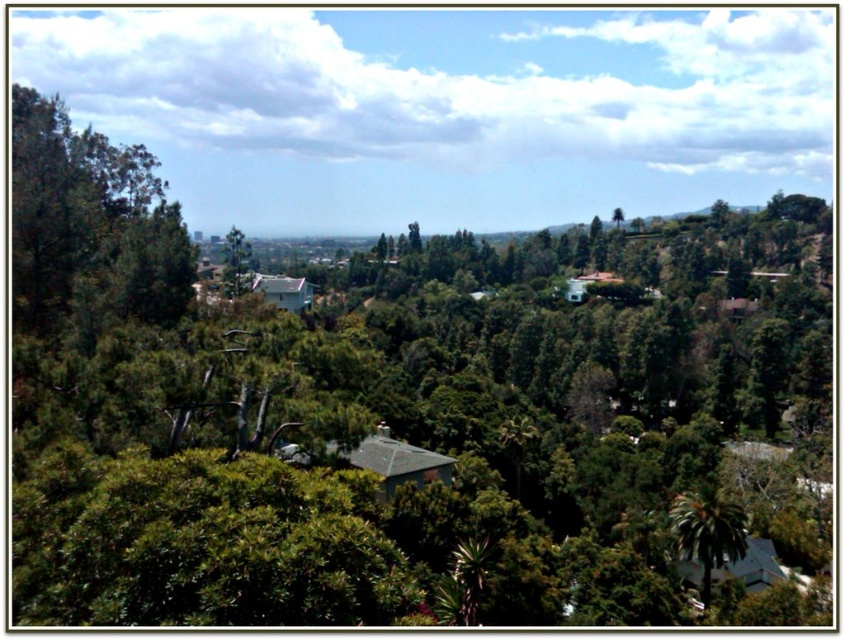
Question: Is green leafy tree at center closer to the viewer compared to green leafy tree at upper center?

Choices:
 (A) yes
 (B) no

Answer: (A)

Question: Considering the real-world distances, which object is farthest from the green leafy tree at center?

Choices:
 (A) green leafy palm tree at lower right
 (B) green leafy tree at upper center

Answer: (B)

Question: Which object appears farthest from the camera in this image?

Choices:
 (A) green leafy palm tree at lower right
 (B) green leafy tree at center

Answer: (A)

Question: Which of the following is the closest to the observer?

Choices:
 (A) (238, 248)
 (B) (619, 211)

Answer: (A)

Question: Does green leafy tree at center have a larger size compared to green leafy tree at upper center?

Choices:
 (A) no
 (B) yes

Answer: (B)

Question: Is green leafy palm tree at lower right bigger than green leafy tree at upper center?

Choices:
 (A) yes
 (B) no

Answer: (B)